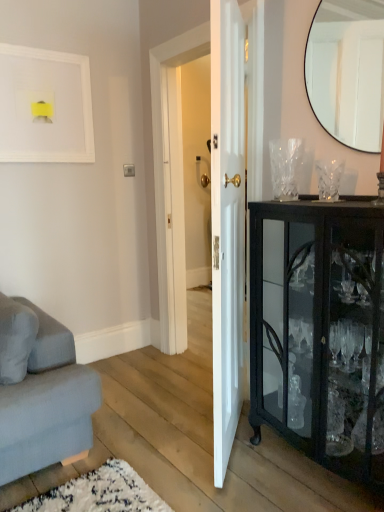
Question: Are white matte picture frame at upper left and black glass cabinet at right located far from each other?

Choices:
 (A) no
 (B) yes

Answer: (B)

Question: Does white matte picture frame at upper left have a lesser width compared to black glass cabinet at right?

Choices:
 (A) no
 (B) yes

Answer: (B)

Question: Does white matte picture frame at upper left have a greater height compared to black glass cabinet at right?

Choices:
 (A) no
 (B) yes

Answer: (A)

Question: From a real-world perspective, does white matte picture frame at upper left sit lower than black glass cabinet at right?

Choices:
 (A) yes
 (B) no

Answer: (B)

Question: Is white matte picture frame at upper left smaller than black glass cabinet at right?

Choices:
 (A) no
 (B) yes

Answer: (B)

Question: Considering the relative positions of white matte picture frame at upper left and black glass cabinet at right in the image provided, is white matte picture frame at upper left in front of black glass cabinet at right?

Choices:
 (A) no
 (B) yes

Answer: (A)

Question: From a real-world perspective, is black glass cabinet at right located beneath white glossy door at center?

Choices:
 (A) no
 (B) yes

Answer: (B)

Question: Is black glass cabinet at right directly adjacent to white glossy door at center?

Choices:
 (A) no
 (B) yes

Answer: (A)

Question: Is the depth of black glass cabinet at right less than that of white glossy door at center?

Choices:
 (A) yes
 (B) no

Answer: (A)

Question: Considering the relative positions of black glass cabinet at right and white glossy door at center in the image provided, is black glass cabinet at right to the left of white glossy door at center from the viewer's perspective?

Choices:
 (A) yes
 (B) no

Answer: (B)

Question: From the image's perspective, is black glass cabinet at right located beneath white glossy door at center?

Choices:
 (A) yes
 (B) no

Answer: (A)

Question: Considering the relative positions of black glass cabinet at right and white glossy door at center in the image provided, is black glass cabinet at right to the right of white glossy door at center from the viewer's perspective?

Choices:
 (A) yes
 (B) no

Answer: (A)

Question: Is matte black mirror at upper right positioned beyond the bounds of black glass cabinet at right?

Choices:
 (A) no
 (B) yes

Answer: (B)